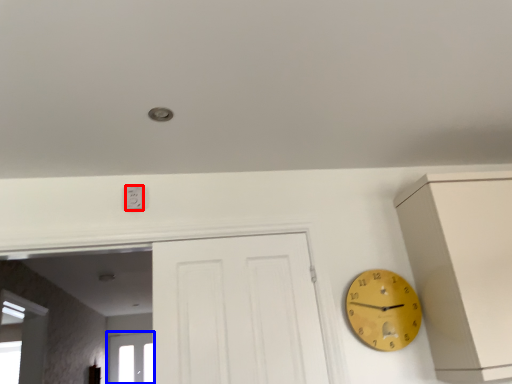
Question: Which point is further to the camera, electric outlet (highlighted by a red box) or window (highlighted by a blue box)?

Choices:
 (A) electric outlet
 (B) window

Answer: (B)